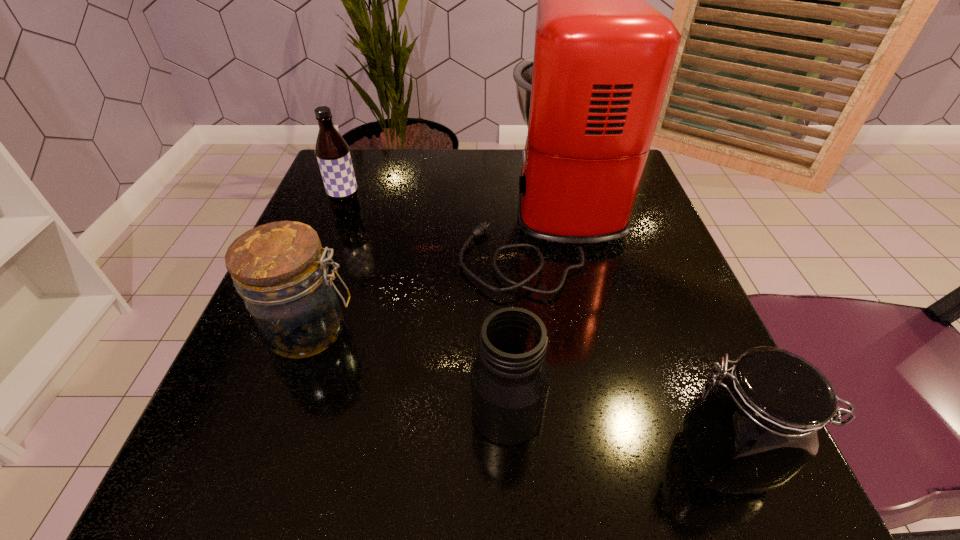
At what (x,y) coordinates should I click in order to perform the action: click on vacant space positioned on the lid of the third nearest object. Please return your answer as a coordinate pair (x, y). Looking at the image, I should click on (606, 330).

This screenshot has width=960, height=540. Find the location of `vacant space situated 0.160m on the right of the second jar from left to right`. vacant space situated 0.160m on the right of the second jar from left to right is located at coordinates (666, 412).

This screenshot has height=540, width=960. I want to click on vacant region located on the lid of the rightmost jar, so click(x=608, y=458).

Locate an element on the screen. This screenshot has width=960, height=540. vacant space situated 0.080m on the lid of the rightmost jar is located at coordinates (608, 458).

This screenshot has width=960, height=540. In order to click on vacant region located 0.290m on the lid of the rightmost jar in this screenshot , I will do `click(433, 458)`.

Identify the location of kitchen mixer present at the far edge. The width and height of the screenshot is (960, 540). (591, 96).

Identify the location of root beer that is positioned at the far edge. The height and width of the screenshot is (540, 960). click(332, 152).

I want to click on root beer that is at the left edge, so click(x=332, y=152).

I want to click on jar situated at the left edge, so click(x=280, y=270).

Identify the location of kitchen mixer that is at the right edge. (591, 96).